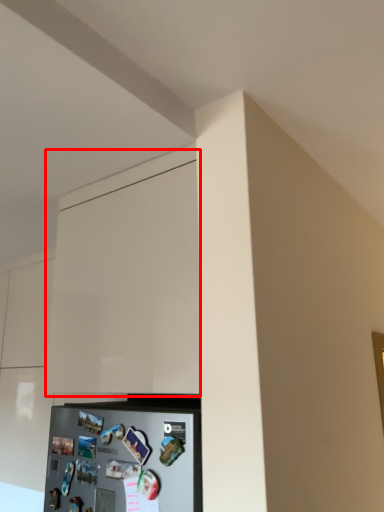
Question: From the image, what is the correct spatial relationship of cabinetry (annotated by the red box) in relation to appliance?

Choices:
 (A) right
 (B) left

Answer: (A)